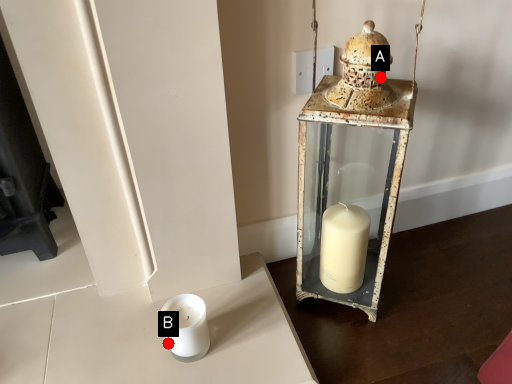
Question: Two points are circled on the image, labeled by A and B beside each circle. Which point is closer to the camera?

Choices:
 (A) A is closer
 (B) B is closer

Answer: (A)